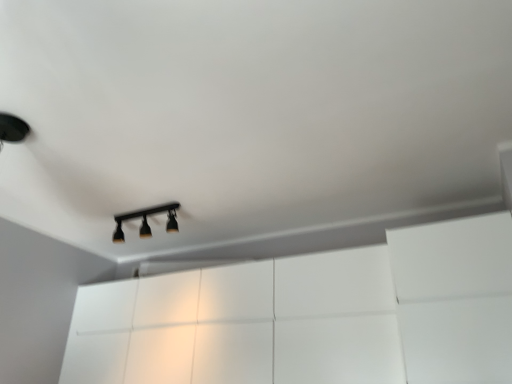
Find the location of `black matte track light at center`. black matte track light at center is located at coordinates (146, 221).

Image resolution: width=512 pixels, height=384 pixels. What do you see at coordinates (146, 221) in the screenshot?
I see `black matte track light at center` at bounding box center [146, 221].

Measure the distance between black matte track light at center and camera.

They are 3.05 meters apart.

Describe the element at coordinates (312, 316) in the screenshot. I see `white glossy dresser at center` at that location.

I want to click on white glossy dresser at center, so click(x=312, y=316).

Where is `black matte track light at center`? black matte track light at center is located at coordinates (146, 221).

Does black matte track light at center appear on the right side of white glossy dresser at center?

In fact, black matte track light at center is to the left of white glossy dresser at center.

Is black matte track light at center behind white glossy dresser at center?

Yes.

Considering the positions of points (116, 237) and (291, 324), is point (116, 237) farther from camera compared to point (291, 324)?

That is True.

From the image's perspective, relative to white glossy dresser at center, is black matte track light at center above or below?

From the image's perspective, black matte track light at center appears above white glossy dresser at center.

From the picture: From a real-world perspective, is black matte track light at center positioned over white glossy dresser at center based on gravity?

Yes, from a real-world perspective, black matte track light at center is over white glossy dresser at center

Looking at their sizes, would you say black matte track light at center is wider or thinner than white glossy dresser at center?

black matte track light at center is thinner than white glossy dresser at center.

In terms of height, does black matte track light at center look taller or shorter compared to white glossy dresser at center?

Considering their sizes, black matte track light at center has less height than white glossy dresser at center.

Can you confirm if black matte track light at center is bigger than white glossy dresser at center?

Incorrect, black matte track light at center is not larger than white glossy dresser at center.

From the picture: Choose the correct answer: Is black matte track light at center inside white glossy dresser at center or outside it?

The correct answer is: outside.

Is black matte track light at center positioned far away from white glossy dresser at center?

Indeed, black matte track light at center is not near white glossy dresser at center.

Is black matte track light at center oriented away from white glossy dresser at center?

No, black matte track light at center's orientation is not away from white glossy dresser at center.

Can you tell me how much black matte track light at center and white glossy dresser at center differ in facing direction?

There is a 89.2-degree angle between the facing directions of black matte track light at center and white glossy dresser at center.

You are a GUI agent. You are given a task and a screenshot of the screen. Output one action in this format:
    pyautogui.click(x=<x>, y=<y>)
    Task: Click on the lamp above the white glossy dresser at center (from the image's perspective)
    The width and height of the screenshot is (512, 384).
    Given the screenshot: What is the action you would take?
    pos(146,221)

Considering the positions of objects white glossy dresser at center and black matte track light at center in the image provided, who is more to the right, white glossy dresser at center or black matte track light at center?

Positioned to the right is white glossy dresser at center.

Is white glossy dresser at center positioned before black matte track light at center?

Yes.

Does point (82, 310) lie behind point (144, 221)?

Yes, it is behind point (144, 221).

From the image's perspective, is white glossy dresser at center under black matte track light at center?

Indeed, from the image's perspective, white glossy dresser at center is shown beneath black matte track light at center.

From a real-world perspective, between white glossy dresser at center and black matte track light at center, who is vertically lower?

From a 3D spatial view, white glossy dresser at center is below.

Considering the sizes of objects white glossy dresser at center and black matte track light at center in the image provided, who is thinner, white glossy dresser at center or black matte track light at center?

black matte track light at center.

Can you confirm if white glossy dresser at center is shorter than black matte track light at center?

No.

Considering the sizes of objects white glossy dresser at center and black matte track light at center in the image provided, who is bigger, white glossy dresser at center or black matte track light at center?

white glossy dresser at center is bigger.

Which is correct: white glossy dresser at center is inside black matte track light at center, or outside of it?

white glossy dresser at center is not inside black matte track light at center, it's outside.

Is white glossy dresser at center positioned far away from black matte track light at center?

Yes, white glossy dresser at center is far from black matte track light at center.

Is white glossy dresser at center positioned with its back to black matte track light at center?

No, white glossy dresser at center is not facing away from black matte track light at center.

This screenshot has height=384, width=512. In order to click on dresser on the right of black matte track light at center in this screenshot , I will do `click(312, 316)`.

Identify the location of lamp lying on the left of white glossy dresser at center. This screenshot has width=512, height=384. (146, 221).

Locate an element on the screen. dresser on the right of black matte track light at center is located at coordinates (312, 316).